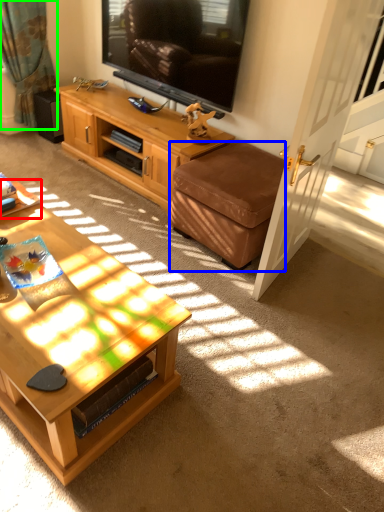
Question: Estimate the real-world distances between objects in this image. Which object is closer to desk (highlighted by a red box), ottoman (highlighted by a blue box) or curtain (highlighted by a green box)?

Choices:
 (A) ottoman
 (B) curtain

Answer: (A)